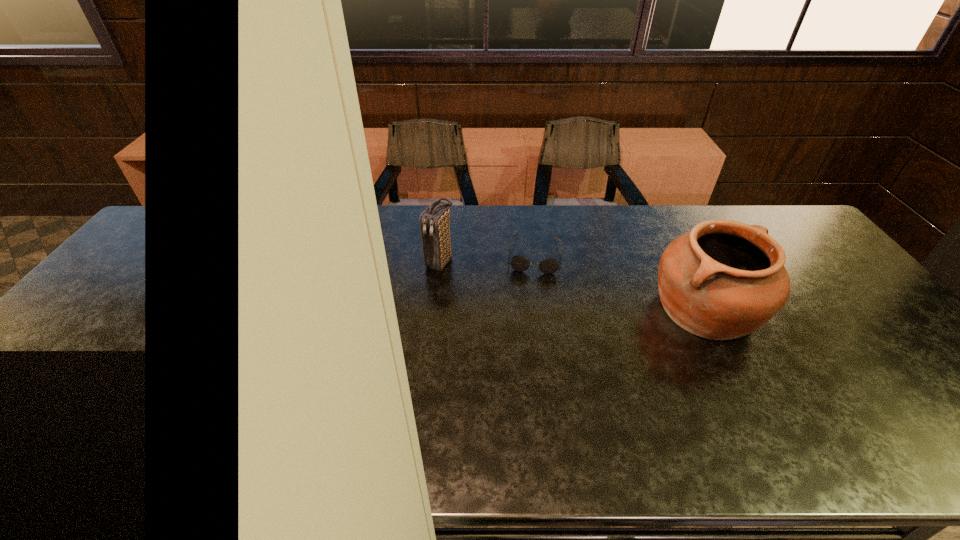
The width and height of the screenshot is (960, 540). I want to click on pottery, so click(x=724, y=279).

This screenshot has width=960, height=540. In order to click on the shortest object in this screenshot , I will do `click(519, 263)`.

Locate an element on the screen. The width and height of the screenshot is (960, 540). sunglasses is located at coordinates (519, 263).

At what (x,y) coordinates should I click in order to perform the action: click on the leftmost object. Please return your answer as a coordinate pair (x, y). The height and width of the screenshot is (540, 960). Looking at the image, I should click on (435, 221).

I want to click on vacant space located 0.370m on the back of the pottery, so click(x=651, y=206).

Where is `vacant space situated on the front-facing side of the sunglasses`? vacant space situated on the front-facing side of the sunglasses is located at coordinates (524, 386).

The width and height of the screenshot is (960, 540). Identify the location of free space located on the front-facing side of the sunglasses. (531, 302).

Identify the location of free space located on the front-facing side of the sunglasses. This screenshot has width=960, height=540. (530, 309).

The width and height of the screenshot is (960, 540). Identify the location of vacant point located 0.120m with the zip open on the leftmost object. (410, 299).

This screenshot has height=540, width=960. I want to click on free space located 0.130m with the zip open on the leftmost object, so click(408, 301).